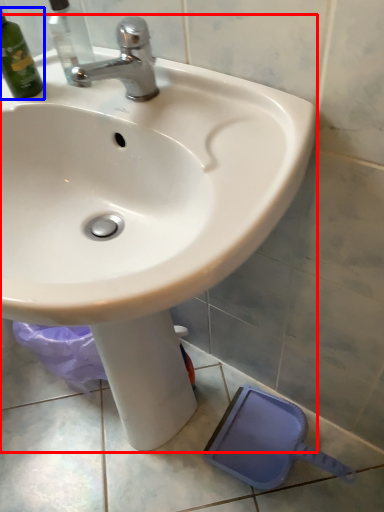
Question: Which of the following is the farthest to the observer, sink (highlighted by a red box) or bottle (highlighted by a blue box)?

Choices:
 (A) sink
 (B) bottle

Answer: (B)